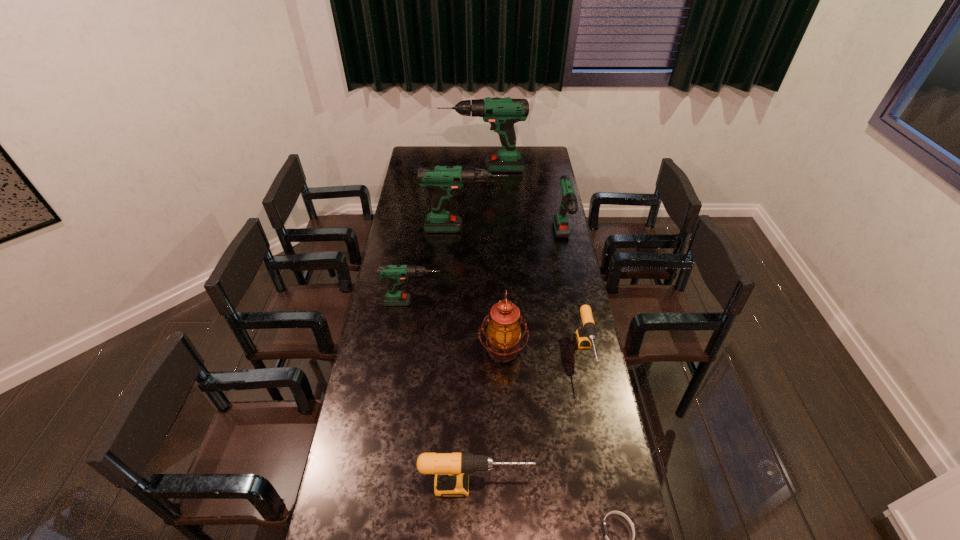
The image size is (960, 540). I want to click on the second nearest drill, so click(584, 335).

What are the coordinates of `the seventh tallest object` in the screenshot? It's located at (584, 335).

At what (x,y) coordinates should I click in order to perform the action: click on free location located on the handle side of the tallest drill. Please return your answer as a coordinate pair (x, y). The image size is (960, 540). Looking at the image, I should click on (411, 169).

The height and width of the screenshot is (540, 960). Identify the location of vacant region located 0.190m on the handle side of the tallest drill. (409, 169).

At what (x,y) coordinates should I click in order to perform the action: click on vacant space situated on the handle side of the tallest drill. Please return your answer as a coordinate pair (x, y). This screenshot has height=540, width=960. Looking at the image, I should click on coord(426,169).

The image size is (960, 540). I want to click on vacant region located 0.250m on the handle side of the third smallest green drill, so click(x=555, y=228).

Where is `free space located on the back of the oil lamp`? Image resolution: width=960 pixels, height=540 pixels. free space located on the back of the oil lamp is located at coordinates (501, 317).

I want to click on vacant space located on the handle side of the third tallest drill, so click(x=571, y=281).

Locate an element on the screen. This screenshot has height=540, width=960. vacant space located 0.250m on the handle side of the smallest green drill is located at coordinates (501, 302).

I want to click on free space located on the handle side of the second nearest object, so click(x=547, y=486).